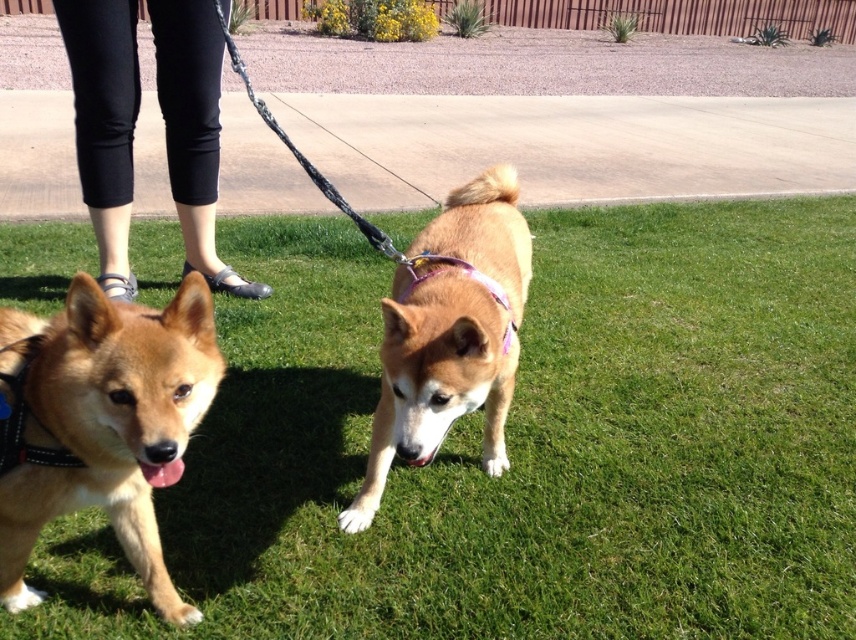
Is green grass at center taller than purple fabric neckband at center?

Indeed, green grass at center has a greater height compared to purple fabric neckband at center.

Who is more forward, (4, 248) or (437, 262)?

Point (437, 262) is more forward.

This screenshot has height=640, width=856. Identify the location of green grass at center. coord(520,448).

Is golden fur dog at center wider than purple fabric neckband at center?

Yes.

This screenshot has height=640, width=856. Describe the element at coordinates (450, 333) in the screenshot. I see `golden fur dog at center` at that location.

Who is more distant from viewer, (390,413) or (486,284)?

Point (390,413)

Where is `golden fur dog at center`? The width and height of the screenshot is (856, 640). golden fur dog at center is located at coordinates (450, 333).

Who is shorter, black fabric pants at upper left or purple fabric neckband at center?

purple fabric neckband at center is shorter.

Is black fabric pants at upper left shorter than purple fabric neckband at center?

No.

Between point (93, 225) and point (484, 282), which one is positioned behind?

Point (93, 225)

Find the location of a particular element. The image size is (856, 640). black fabric pants at upper left is located at coordinates (104, 122).